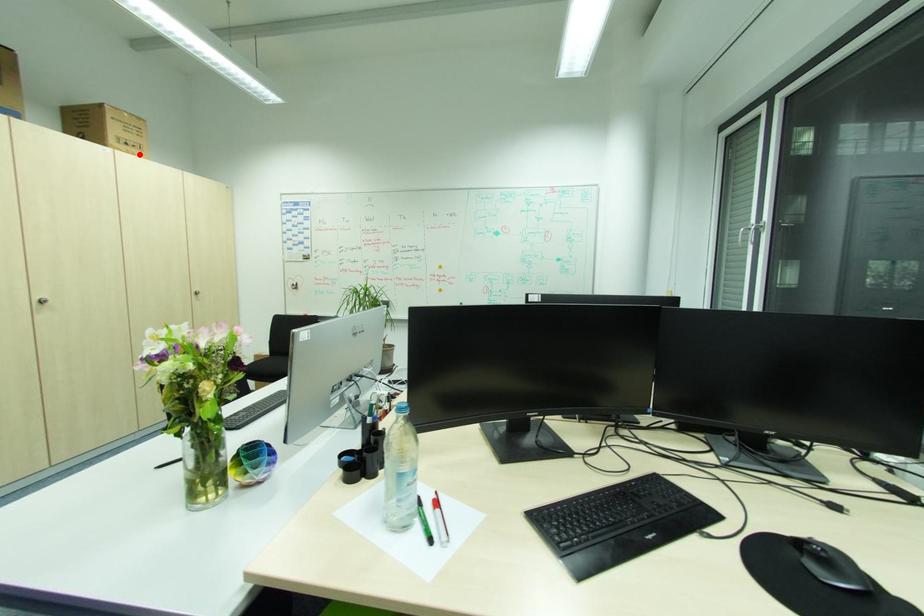
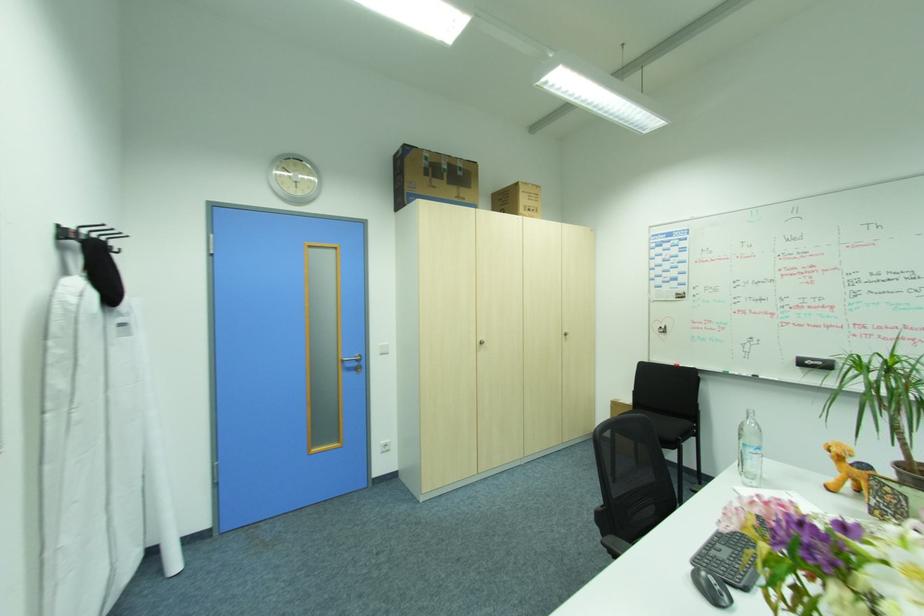
The point at the highlighted location is marked in the first image. Where is the corresponding point in the second image?

(538, 217)